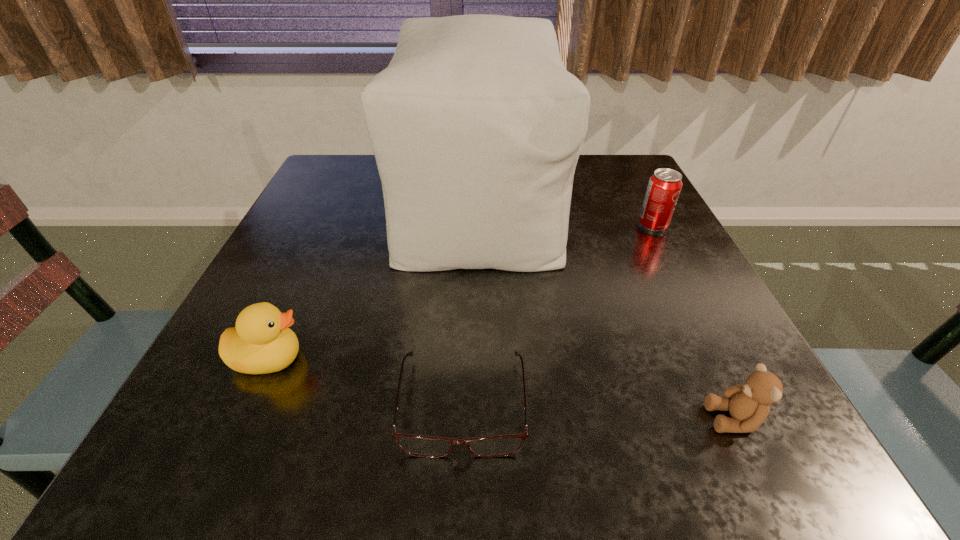
Where is `free region located on the front-facing side of the fourth tallest object`? The height and width of the screenshot is (540, 960). free region located on the front-facing side of the fourth tallest object is located at coordinates (474, 419).

Find the location of a particular element. The width and height of the screenshot is (960, 540). object that is at the far edge is located at coordinates (x=476, y=126).

Locate an element on the screen. This screenshot has height=540, width=960. teddy bear that is at the near edge is located at coordinates pyautogui.click(x=748, y=404).

I want to click on spectacles at the near edge, so click(x=417, y=445).

You are a GUI agent. You are given a task and a screenshot of the screen. Output one action in this format:
    pyautogui.click(x=<x>, y=<y>)
    Task: Click on the object that is at the left edge
    The width and height of the screenshot is (960, 540).
    Given the screenshot: What is the action you would take?
    pyautogui.click(x=261, y=342)

Find the location of `soda positioned at the right edge`. soda positioned at the right edge is located at coordinates (664, 186).

What are the coordinates of `teddy bear that is at the right edge` in the screenshot? It's located at (748, 404).

Locate an element on the screen. This screenshot has width=960, height=540. object that is positioned at the near right corner is located at coordinates (748, 404).

In the image, there is a desktop. Identify the location of free space at the near edge. (354, 432).

This screenshot has height=540, width=960. In the image, there is a desktop. Find the location of `vacant space at the left edge`. vacant space at the left edge is located at coordinates (323, 239).